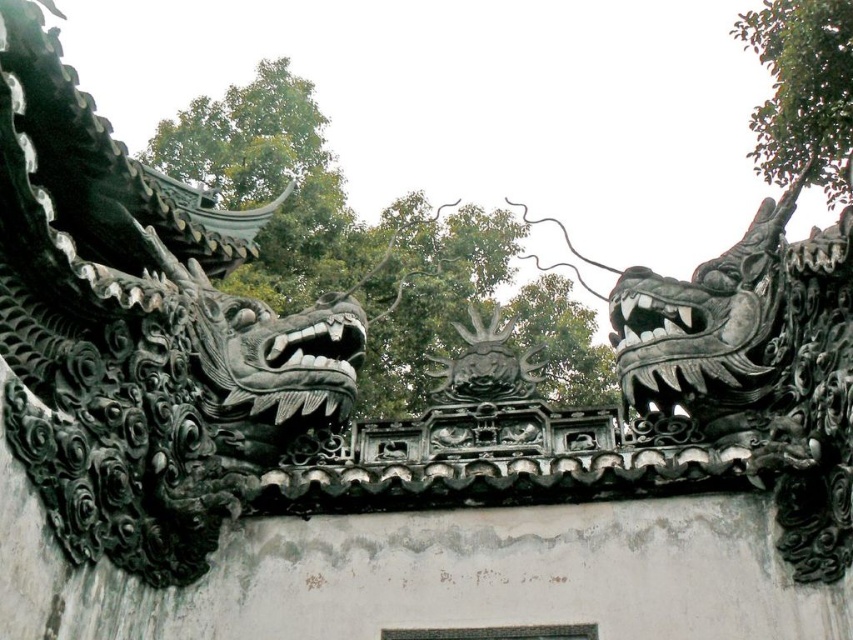
Describe the element at coordinates (764, 376) in the screenshot. This screenshot has height=640, width=853. I see `black stone dragon head at upper right` at that location.

In the scene shown: Who is more forward, (801,545) or (279,362)?

Positioned in front is point (801,545).

Where is `black stone dragon head at upper right`? This screenshot has height=640, width=853. black stone dragon head at upper right is located at coordinates (764, 376).

Consider the image. Between black stone dragon mouth at center and matte black dragon mouth at center, which one appears on the left side from the viewer's perspective?

Positioned to the left is matte black dragon mouth at center.

Does black stone dragon mouth at center have a greater height compared to matte black dragon mouth at center?

In fact, black stone dragon mouth at center may be shorter than matte black dragon mouth at center.

Locate an element on the screen. This screenshot has height=640, width=853. black stone dragon mouth at center is located at coordinates (654, 316).

Can you confirm if black stone dragon head at upper right is positioned to the right of black stone dragon mouth at center?

Indeed, black stone dragon head at upper right is positioned on the right side of black stone dragon mouth at center.

Can you confirm if black stone dragon head at upper right is thinner than black stone dragon mouth at center?

Incorrect, black stone dragon head at upper right's width is not less than black stone dragon mouth at center's.

Is point (741, 380) less distant than point (646, 314)?

Yes, it is in front of point (646, 314).

At what (x,y) coordinates should I click in order to perform the action: click on black stone dragon head at upper right. Please return your answer as a coordinate pair (x, y). The height and width of the screenshot is (640, 853). Looking at the image, I should click on (764, 376).